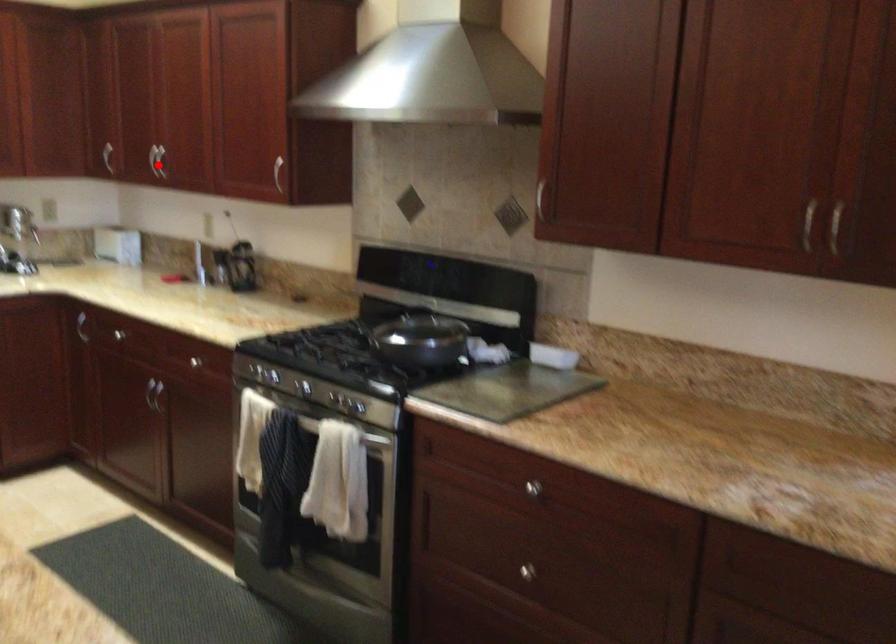
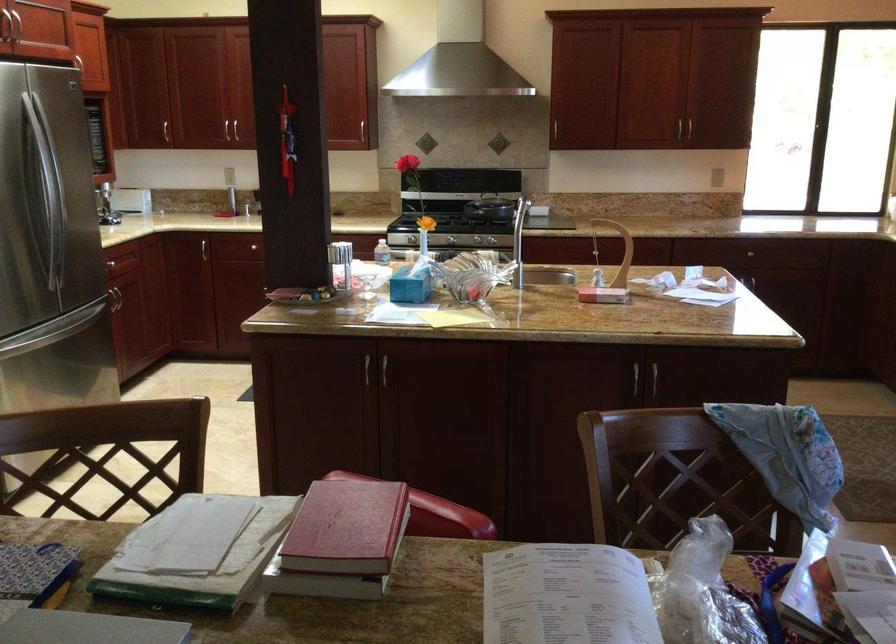
Question: I am providing you with two images of the same scene from different viewpoints. Given a red point in image1, look at the same physical point in image2. Is it:

Choices:
 (A) Closer to the viewpoint
 (B) Farther from the viewpoint

Answer: (B)